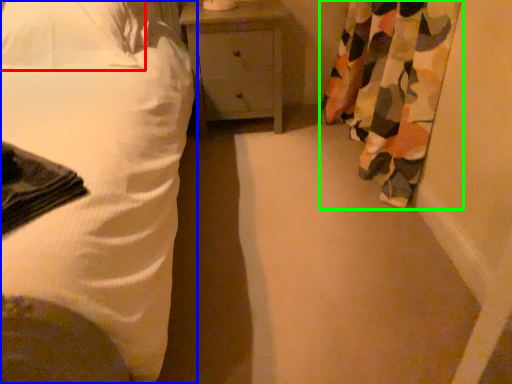
Question: Which object is the farthest from pillow (highlighted by a red box)? Choose among these: bed (highlighted by a blue box) or curtain (highlighted by a green box).

Choices:
 (A) bed
 (B) curtain

Answer: (B)